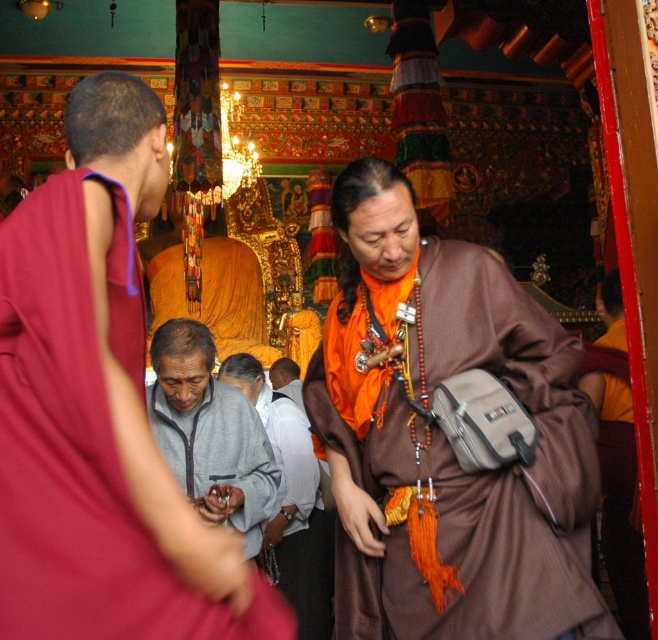
Can you confirm if brown matte robe at center is positioned below gray fleece jacket at center?

No, brown matte robe at center is not below gray fleece jacket at center.

Is point (443, 316) closer to viewer compared to point (213, 420)?

That is True.

In order to click on brown matte robe at center in this screenshot , I will do `click(467, 472)`.

Who is taller, matte red robe at center or gray fleece jacket at center?

Standing taller between the two is matte red robe at center.

Does point (141, 339) lie in front of point (155, 340)?

That is True.

The image size is (658, 640). Find the location of `matte red robe at center`. matte red robe at center is located at coordinates (84, 444).

Based on the photo, which is below, gray fleece jacket at center or orange fabric at center?

orange fabric at center is lower down.

Identify the location of gray fleece jacket at center. (209, 433).

Identify the location of gray fleece jacket at center. The image size is (658, 640). (209, 433).